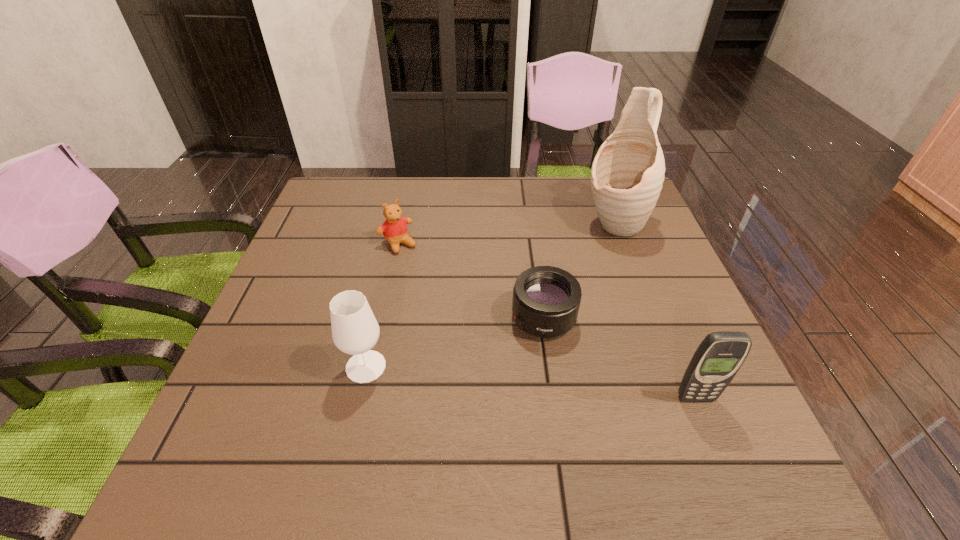
I want to click on free area in between the second nearest object and the second shortest object, so click(x=382, y=305).

Locate an element on the screen. The width and height of the screenshot is (960, 540). object that ranks as the second closest to the pitcher is located at coordinates (720, 355).

I want to click on the closest object to the cellular telephone, so click(x=546, y=299).

Find the location of a particular element. vacant space that satisfies the following two spatial constraints: 1. on the back side of the shortest object; 2. on the left side of the pitcher is located at coordinates (531, 224).

Where is `vacant position in the image that satisfies the following two spatial constraints: 1. on the back side of the fourth farthest object; 2. on the right side of the tallest object`? Image resolution: width=960 pixels, height=540 pixels. vacant position in the image that satisfies the following two spatial constraints: 1. on the back side of the fourth farthest object; 2. on the right side of the tallest object is located at coordinates click(x=398, y=224).

Locate an element on the screen. This screenshot has width=960, height=540. free space in the image that satisfies the following two spatial constraints: 1. on the back side of the fourth farthest object; 2. on the left side of the teddy bear is located at coordinates [x=394, y=244].